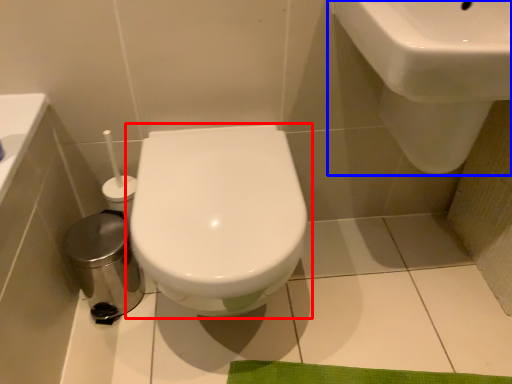
Question: Which point is closer to the camera, toilet (highlighted by a red box) or sink (highlighted by a blue box)?

Choices:
 (A) toilet
 (B) sink

Answer: (B)